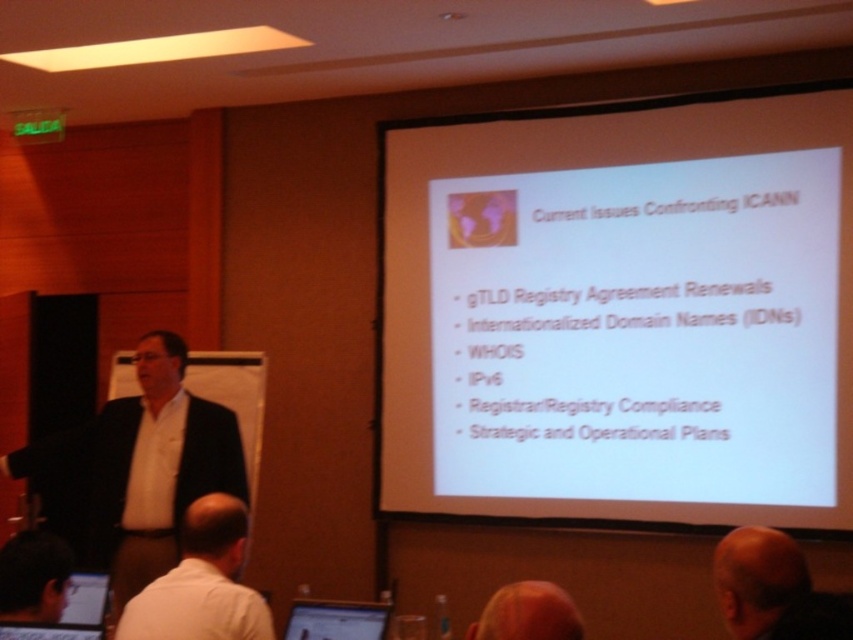
Can you confirm if white shirt at left is wider than matte black laptop at lower left?

Yes.

Does white shirt at left appear over matte black laptop at lower left?

Indeed, white shirt at left is positioned over matte black laptop at lower left.

Is point (194, 432) closer to camera compared to point (96, 609)?

No, (194, 432) is further to viewer.

The height and width of the screenshot is (640, 853). Identify the location of white shirt at left. (144, 467).

Who is shorter, white shirt at left or brown hair at upper center?

With less height is brown hair at upper center.

Is point (51, 449) positioned before point (495, 628)?

No, it is behind (495, 628).

Image resolution: width=853 pixels, height=640 pixels. In order to click on white shirt at left in this screenshot , I will do `click(144, 467)`.

Is white shirt at lower left closer to the viewer compared to bald head at lower right?

No, it is not.

Who is shorter, white shirt at lower left or bald head at lower right?

With less height is bald head at lower right.

Is point (190, 620) positioned after point (737, 532)?

Yes, it is.

Where is `white shirt at lower left`? white shirt at lower left is located at coordinates (202, 582).